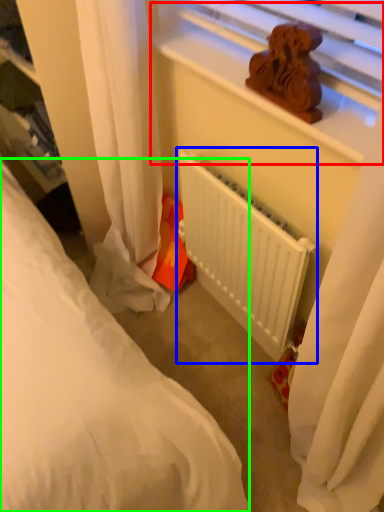
Question: Which object is the closest to the window sill (highlighted by a red box)? Choose among these: radiator (highlighted by a blue box) or bed (highlighted by a green box).

Choices:
 (A) radiator
 (B) bed

Answer: (A)